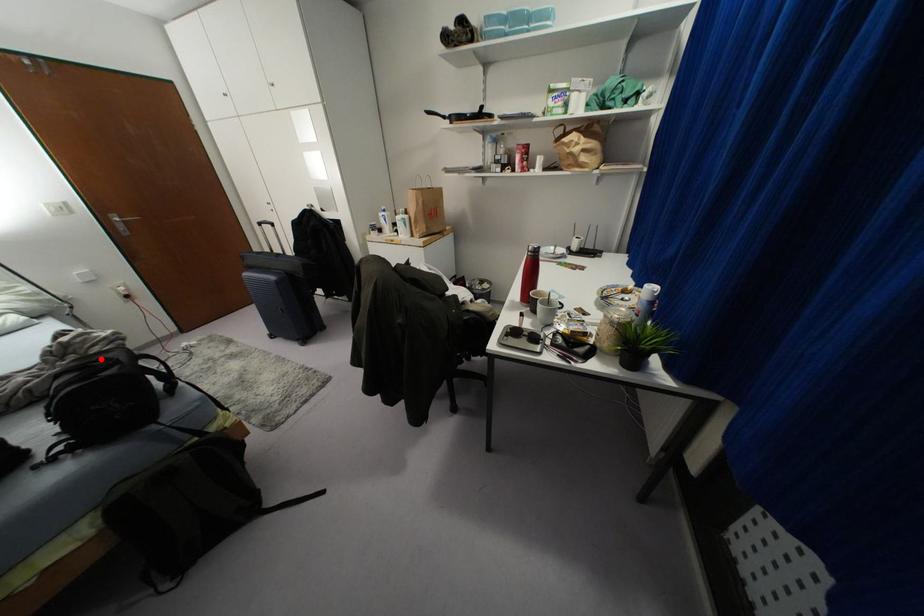
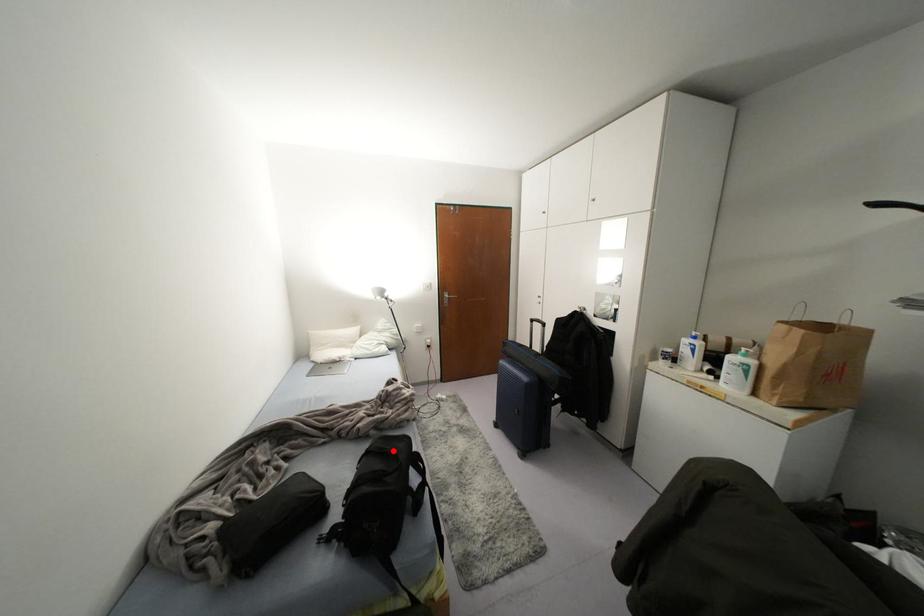
I am providing you with two images of the same scene from different viewpoints. A red point is marked on the first image and another point is marked on the second image. Does the point marked in image1 correspond to the same location as the one in image2?

Yes